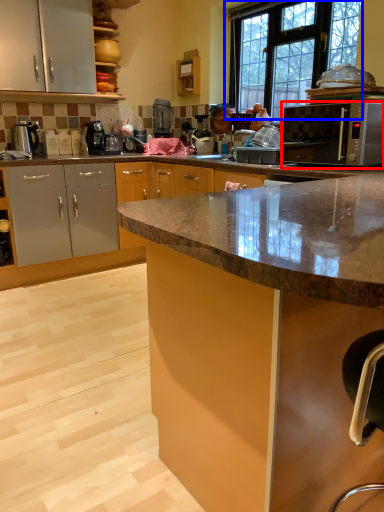
Question: Which object appears closest to the camera in this image, microwave oven (highlighted by a red box) or window (highlighted by a blue box)?

Choices:
 (A) microwave oven
 (B) window

Answer: (A)